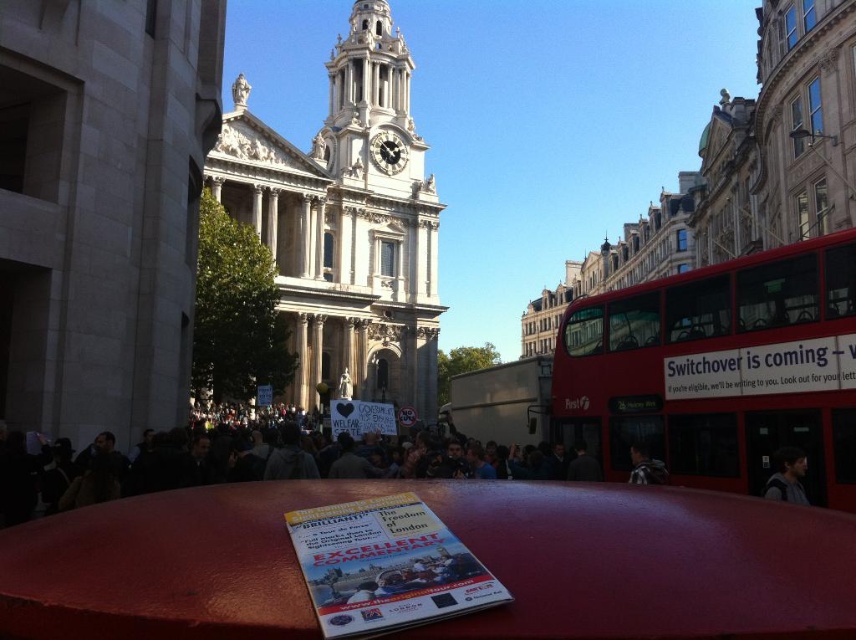
Question: Can you confirm if dark gray fabric crowd at center is smaller than dark gray fabric jacket at lower right?

Choices:
 (A) no
 (B) yes

Answer: (A)

Question: Estimate the real-world distances between objects in this image. Which object is farther from the red metallic bus at right?

Choices:
 (A) dark gray fabric crowd at center
 (B) dark brown leather jacket at center
 (C) dark gray fabric jacket at lower right

Answer: (A)

Question: Where is red metallic bus at right located in relation to dark gray fabric crowd at center in the image?

Choices:
 (A) above
 (B) below

Answer: (A)

Question: Can you confirm if red metallic bus at right is positioned below dark gray fabric crowd at center?

Choices:
 (A) yes
 (B) no

Answer: (B)

Question: Estimate the real-world distances between objects in this image. Which object is closer to the dark gray fabric crowd at center?

Choices:
 (A) red metallic bus at right
 (B) dark brown leather jacket at center
 (C) dark gray fabric jacket at lower right

Answer: (A)

Question: Which object appears farthest from the camera in this image?

Choices:
 (A) dark brown leather jacket at center
 (B) dark gray fabric crowd at center
 (C) dark gray fabric jacket at lower right

Answer: (A)